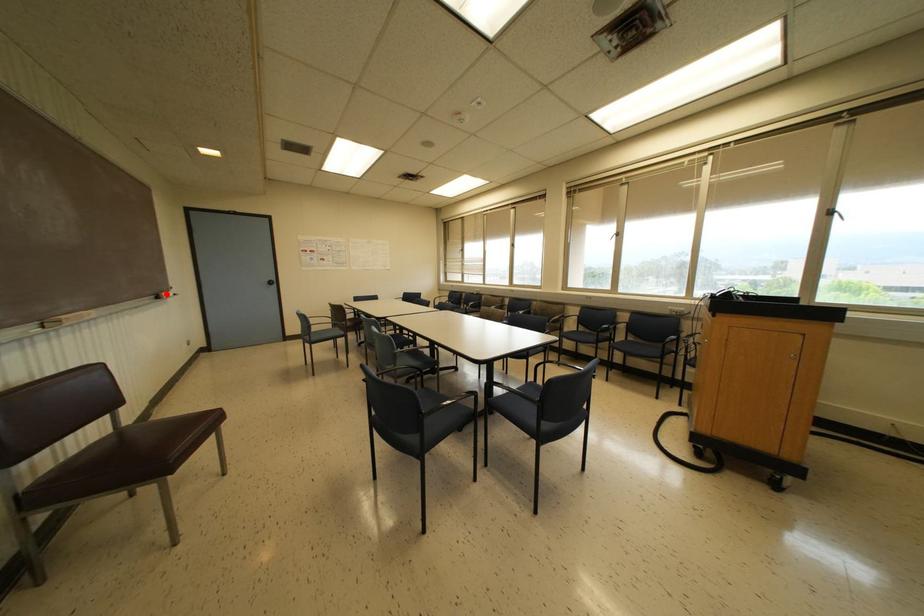
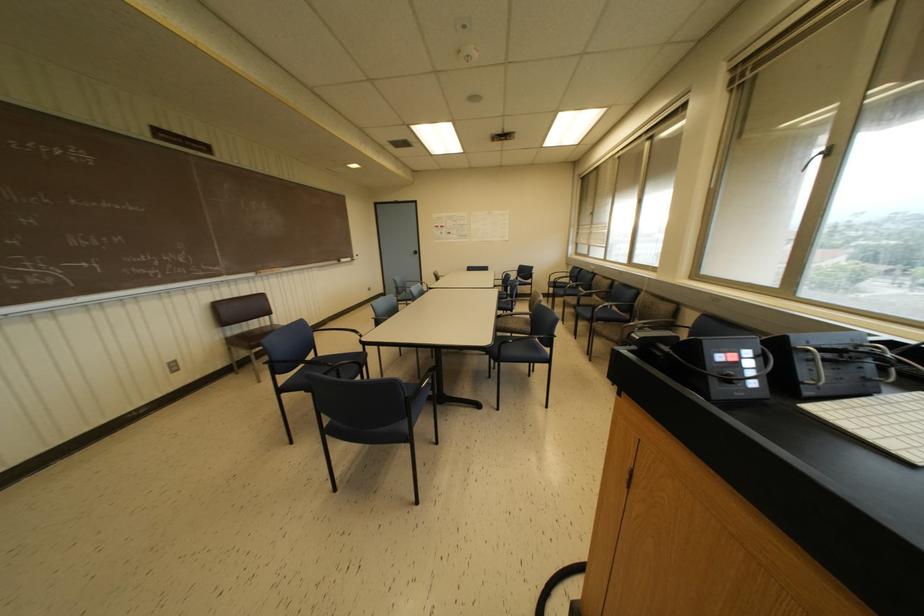
In the second image, find the point that corresponds to the highlighted location in the first image.

(342, 259)